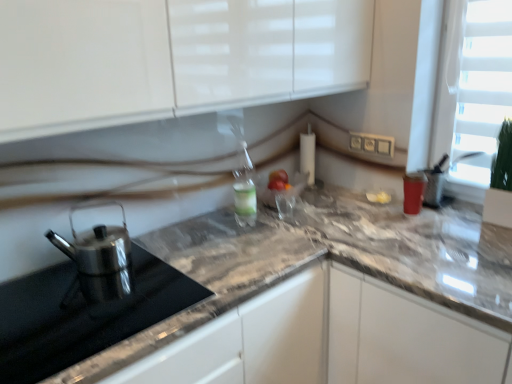
This screenshot has width=512, height=384. Identify the location of marble countertop at right. (405, 337).

What is the approximate height of polished stainless steel kettle at left?

It is 19.37 centimeters.

Find the location of `marble countertop at right`. marble countertop at right is located at coordinates (405, 337).

Considering the relative sizes of marble countertop at right and polished stainless steel kettle at left in the image provided, is marble countertop at right shorter than polished stainless steel kettle at left?

In fact, marble countertop at right may be taller than polished stainless steel kettle at left.

From the picture: Is the position of marble countertop at right more distant than that of polished stainless steel kettle at left?

Yes.

From a real-world perspective, is marble countertop at right over polished stainless steel kettle at left?

No.

What's the angular difference between marble countertop at right and polished stainless steel kettle at left's facing directions?

The angular difference between marble countertop at right and polished stainless steel kettle at left is 90.4 degrees.

Who is shorter, polished stainless steel kettle at left or marble countertop at right?

polished stainless steel kettle at left.

Is polished stainless steel kettle at left with marble countertop at right?

No, polished stainless steel kettle at left is not in contact with marble countertop at right.

From a real-world perspective, is polished stainless steel kettle at left physically below marble countertop at right?

Actually, polished stainless steel kettle at left is physically above marble countertop at right in the real world.

From a real-world perspective, is marble countertop at right on top of polished stainless steel kettle at left?

Actually, marble countertop at right is physically below polished stainless steel kettle at left in the real world.

In the scene shown: Is marble countertop at right touching polished stainless steel kettle at left?

No, marble countertop at right is not with polished stainless steel kettle at left.

Which object is closer to the camera taking this photo, marble countertop at right or polished stainless steel kettle at left?

marble countertop at right.

Does polished stainless steel kettle at left have a greater width compared to polished stainless steel kettle at left?

Incorrect, the width of polished stainless steel kettle at left does not surpass that of polished stainless steel kettle at left.

Looking at this image, does polished stainless steel kettle at left have a lesser height compared to polished stainless steel kettle at left?

In fact, polished stainless steel kettle at left may be taller than polished stainless steel kettle at left.

From the image's perspective, who appears lower, polished stainless steel kettle at left or polished stainless steel kettle at left?

From the image's view, polished stainless steel kettle at left is below.

Identify the location of cabinetry on the right of polished stainless steel kettle at left. (405, 337).

Is point (78, 358) farther from camera compared to point (486, 326)?

No, (78, 358) is in front of (486, 326).

Between polished stainless steel kettle at left and marble countertop at right, which one appears on the left side from the viewer's perspective?

From the viewer's perspective, polished stainless steel kettle at left appears more on the left side.

In the scene shown: From the image's perspective, which one is positioned higher, polished stainless steel kettle at left or marble countertop at right?

polished stainless steel kettle at left appears higher in the image.

Is polished stainless steel kettle at left in front of polished stainless steel kettle at left?

Yes, it is in front of polished stainless steel kettle at left.

Is polished stainless steel kettle at left thinner than polished stainless steel kettle at left?

In fact, polished stainless steel kettle at left might be wider than polished stainless steel kettle at left.

Can you confirm if polished stainless steel kettle at left is shorter than polished stainless steel kettle at left?

Indeed, polished stainless steel kettle at left has a lesser height compared to polished stainless steel kettle at left.

At what (x,y) coordinates should I click in order to perform the action: click on cabinetry directly beneath the polished stainless steel kettle at left (from a real-world perspective). Please return your answer as a coordinate pair (x, y). This screenshot has height=384, width=512. Looking at the image, I should click on (405, 337).

Image resolution: width=512 pixels, height=384 pixels. In order to click on kitchen appliance that is above the marble countertop at right (from a real-world perspective) in this screenshot , I will do `click(98, 259)`.

From the image, which object appears to be nearer to polished stainless steel kettle at left, polished stainless steel kettle at left or marble countertop at right?

The object closer to polished stainless steel kettle at left is polished stainless steel kettle at left.

Considering their positions, is marble countertop at right positioned further to polished stainless steel kettle at left than polished stainless steel kettle at left?

Based on the image, marble countertop at right appears to be further to polished stainless steel kettle at left.

Estimate the real-world distances between objects in this image. Which object is further from polished stainless steel kettle at left, polished stainless steel kettle at left or marble countertop at right?

marble countertop at right lies further to polished stainless steel kettle at left than the other object.

When comparing their distances from polished stainless steel kettle at left, does marble countertop at right or polished stainless steel kettle at left seem closer?

polished stainless steel kettle at left is closer to polished stainless steel kettle at left.

Estimate the real-world distances between objects in this image. Which object is further from marble countertop at right, polished stainless steel kettle at left or polished stainless steel kettle at left?

polished stainless steel kettle at left lies further to marble countertop at right than the other object.

Which object lies nearer to the anchor point marble countertop at right, polished stainless steel kettle at left or polished stainless steel kettle at left?

Based on the image, polished stainless steel kettle at left appears to be nearer to marble countertop at right.

Where is `appliance situated between polished stainless steel kettle at left and marble countertop at right from left to right`? appliance situated between polished stainless steel kettle at left and marble countertop at right from left to right is located at coordinates (82, 315).